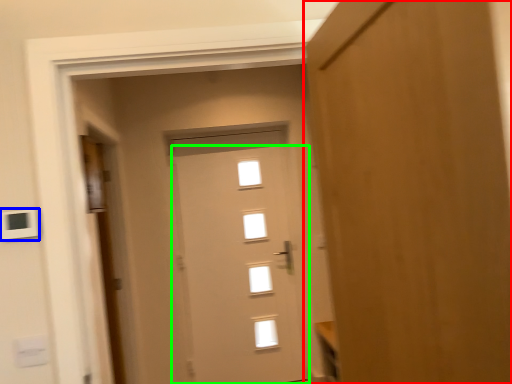
Question: Which object is the closest to the door (highlighted by a red box)? Choose among these: light switch (highlighted by a blue box) or door (highlighted by a green box).

Choices:
 (A) light switch
 (B) door

Answer: (A)